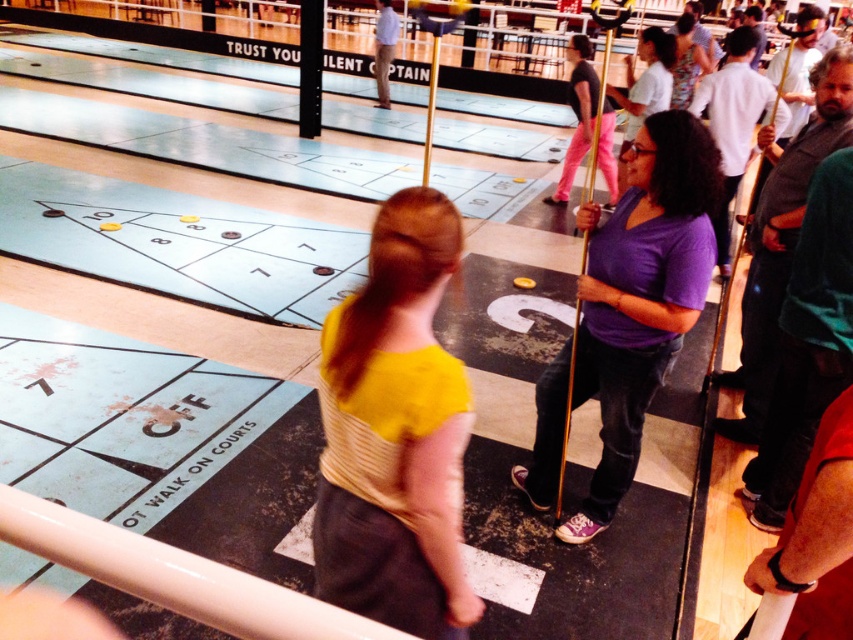
Question: Based on their relative distances, which object is farther from the yellow fabric shirt at center?

Choices:
 (A) purple matte shirt at center
 (B) matte purple shirt at center

Answer: (B)

Question: Is yellow fabric shirt at center to the right of purple matte shirt at center from the viewer's perspective?

Choices:
 (A) no
 (B) yes

Answer: (A)

Question: From the image, what is the correct spatial relationship of yellow fabric shirt at center in relation to purple matte shirt at center?

Choices:
 (A) left
 (B) right

Answer: (A)

Question: Which point is farther from the camera taking this photo?

Choices:
 (A) (595, 241)
 (B) (579, 44)

Answer: (B)

Question: Can you confirm if yellow fabric shirt at center is positioned above matte purple shirt at center?

Choices:
 (A) yes
 (B) no

Answer: (B)

Question: Which is nearer to the yellow fabric shirt at center?

Choices:
 (A) matte purple shirt at center
 (B) purple matte shirt at center

Answer: (B)